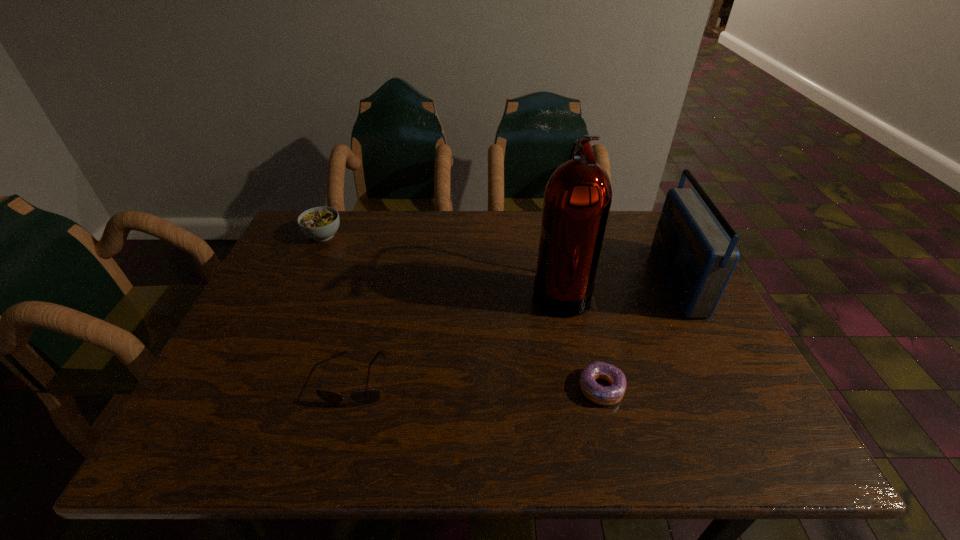
Image resolution: width=960 pixels, height=540 pixels. Find the location of `object that is at the right edge`. object that is at the right edge is located at coordinates (697, 258).

Locate an element on the screen. object located at the far left corner is located at coordinates (319, 223).

What are the coordinates of `object that is at the far right corner` in the screenshot? It's located at (697, 258).

This screenshot has width=960, height=540. Find the location of `free space at the far edge of the desktop`. free space at the far edge of the desktop is located at coordinates (437, 221).

This screenshot has height=540, width=960. Identify the location of free space at the near edge. (361, 430).

Identify the location of vacant space at the left edge. (261, 327).

At what (x,y) coordinates should I click in order to perform the action: click on free spot at the right edge of the desktop. Please return your answer as a coordinate pair (x, y). Looking at the image, I should click on (695, 345).

Identify the location of vacant space at the far left corner. This screenshot has height=540, width=960. (308, 244).

Locate an element on the screen. Image resolution: width=960 pixels, height=540 pixels. vacant space at the near left corner is located at coordinates (171, 451).

At what (x,y) coordinates should I click in order to perform the action: click on free location at the far right corner. Please return your answer as a coordinate pair (x, y). Looking at the image, I should click on (615, 233).